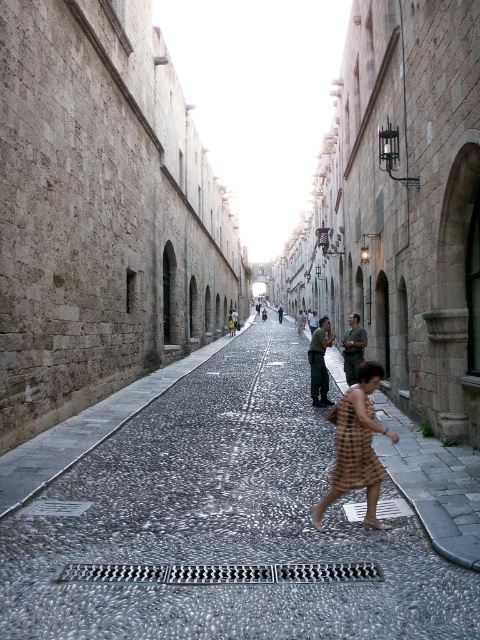
Question: Which point appears farthest from the camera in this image?

Choices:
 (A) (372, 525)
 (B) (43, 582)

Answer: (A)

Question: Which point appears closest to the camera in this image?

Choices:
 (A) (339, 452)
 (B) (345, 452)
 (C) (300, 362)

Answer: (B)

Question: Is gray cobblestone pavement at center closer to camera compared to brown plaid dress at center?

Choices:
 (A) no
 (B) yes

Answer: (B)

Question: Can you confirm if gray cobblestone pavement at center is positioned to the left of brown checkered dress at center?

Choices:
 (A) yes
 (B) no

Answer: (A)

Question: Is gray cobblestone pavement at center above brown plaid dress at center?

Choices:
 (A) no
 (B) yes

Answer: (A)

Question: Which point is farther to the camera?

Choices:
 (A) gray cobblestone pavement at center
 (B) brown plaid dress at center
 (C) brown checkered dress at center

Answer: (B)